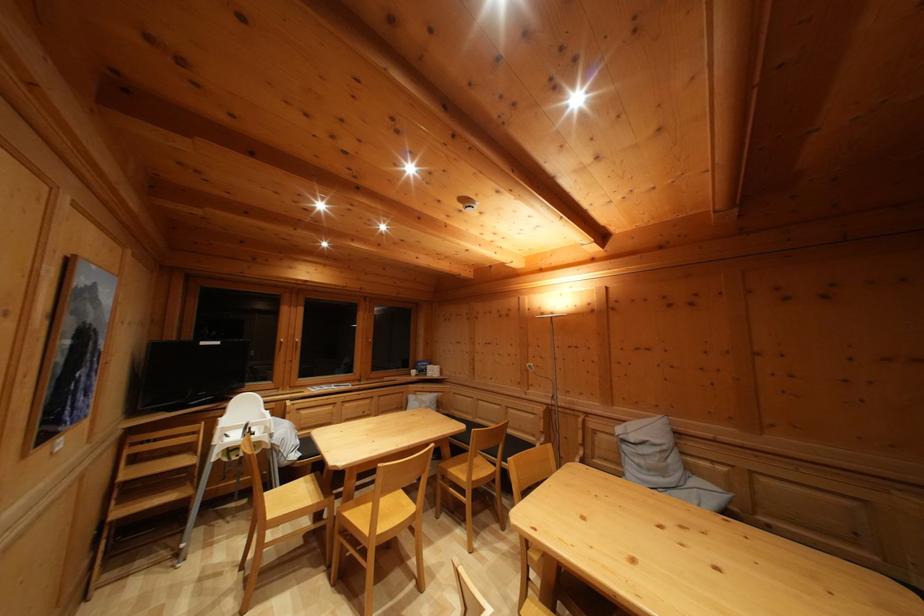
The width and height of the screenshot is (924, 616). What do you see at coordinates (296, 345) in the screenshot?
I see `the window handle` at bounding box center [296, 345].